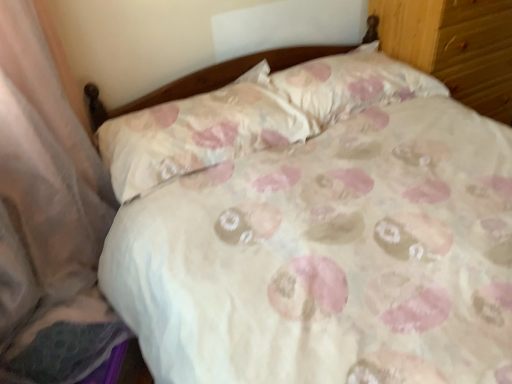
Question: From the image's perspective, is wooden dresser at upper right above or below white fabric pillow at center, which is counted as the 1th pillow, starting from the left?

Choices:
 (A) below
 (B) above

Answer: (B)

Question: Based on their sizes in the image, would you say wooden dresser at upper right is bigger or smaller than white fabric pillow at center, which is counted as the 1th pillow, starting from the left?

Choices:
 (A) big
 (B) small

Answer: (A)

Question: Estimate the real-world distances between objects in this image. Which object is closer to the white fabric pillow at center, which is counted as the 1th pillow, starting from the left?

Choices:
 (A) floral fabric pillow at upper center, placed as the first pillow when sorted from right to left
 (B) wooden dresser at upper right

Answer: (A)

Question: Considering the real-world distances, which object is closest to the floral fabric pillow at upper center, placed as the first pillow when sorted from right to left?

Choices:
 (A) wooden dresser at upper right
 (B) white fabric pillow at center, the 2th pillow in the right-to-left sequence

Answer: (B)